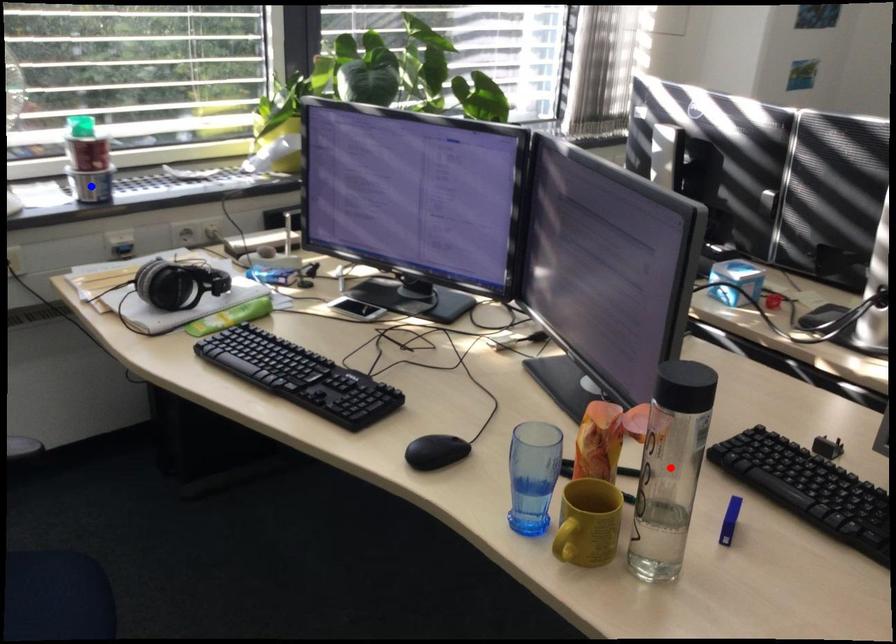
Question: In the image, two points are highlighted. Which point is nearer to the camera? Reply with the corresponding letter.

Choices:
 (A) blue point
 (B) red point

Answer: (B)